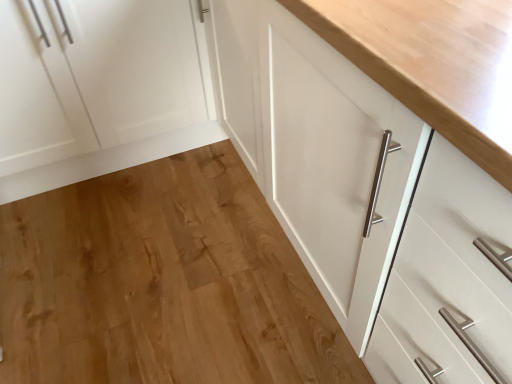
Question: Considering their positions, is white matte cabinet at left located in front of or behind natural wood floor at center?

Choices:
 (A) front
 (B) behind

Answer: (B)

Question: Considering the positions of point (47, 177) and point (180, 210), is point (47, 177) closer or farther from the camera than point (180, 210)?

Choices:
 (A) closer
 (B) farther

Answer: (B)

Question: Would you say white matte cabinet at left is to the left or to the right of natural wood floor at center in the picture?

Choices:
 (A) left
 (B) right

Answer: (A)

Question: Is natural wood floor at center taller or shorter than white matte cabinet at left?

Choices:
 (A) short
 (B) tall

Answer: (A)

Question: From a real-world perspective, is natural wood floor at center positioned above or below white matte cabinet at left?

Choices:
 (A) above
 (B) below

Answer: (B)

Question: Is natural wood floor at center in front of or behind white matte cabinet at left in the image?

Choices:
 (A) behind
 (B) front

Answer: (B)

Question: From the image's perspective, relative to white matte cabinet at left, is natural wood floor at center above or below?

Choices:
 (A) above
 (B) below

Answer: (B)